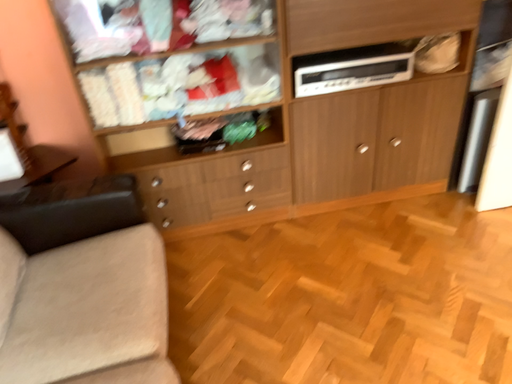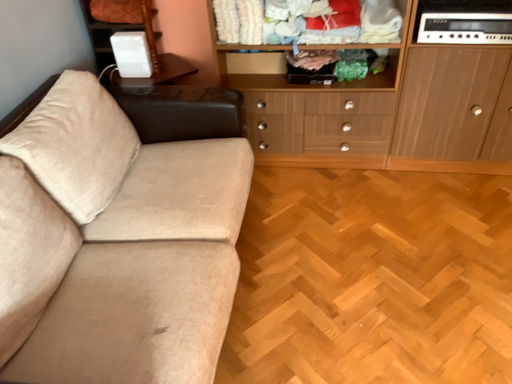
Question: Which way did the camera rotate in the video?

Choices:
 (A) rotated left
 (B) rotated right

Answer: (A)